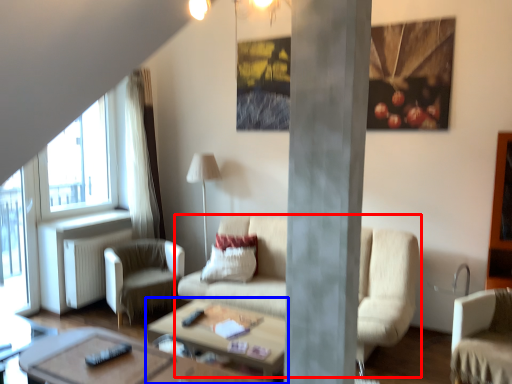
Question: Among these objects, which one is farthest to the camera, studio couch (highlighted by a red box) or coffee table (highlighted by a blue box)?

Choices:
 (A) studio couch
 (B) coffee table

Answer: (A)